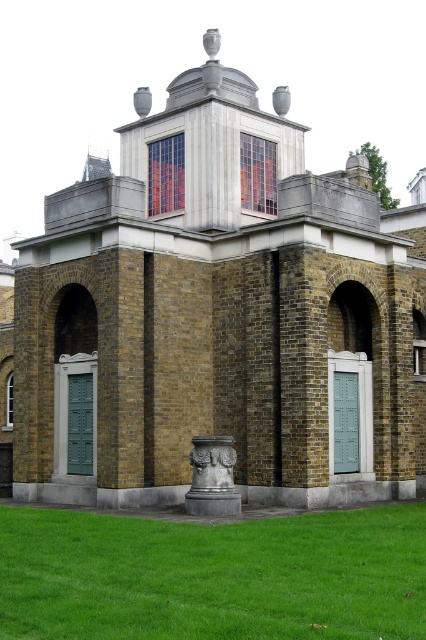
Question: Does green grass at lower center appear on the right side of dark gray stone column at center?

Choices:
 (A) no
 (B) yes

Answer: (B)

Question: Which object appears closest to the camera in this image?

Choices:
 (A) dark gray stone column at center
 (B) green grass at lower center

Answer: (B)

Question: Among these points, which one is farthest from the camera?

Choices:
 (A) coord(198,483)
 (B) coord(316,579)

Answer: (A)

Question: Which point is closer to the camera taking this photo?

Choices:
 (A) (224, 468)
 (B) (307, 579)

Answer: (B)

Question: Is green grass at lower center thinner than dark gray stone column at center?

Choices:
 (A) no
 (B) yes

Answer: (A)

Question: Is green grass at lower center positioned in front of dark gray stone column at center?

Choices:
 (A) yes
 (B) no

Answer: (A)